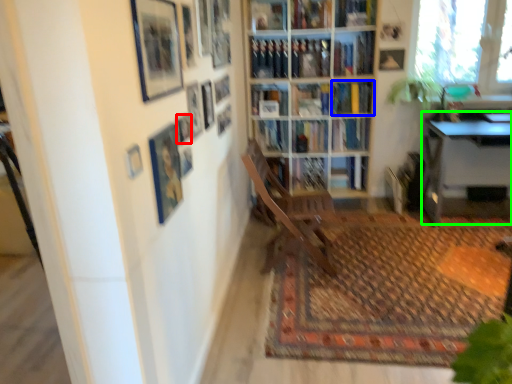
Question: Which is farther away from picture frame (highlighted by a red box)? book (highlighted by a blue box) or table (highlighted by a green box)?

Choices:
 (A) book
 (B) table

Answer: (B)